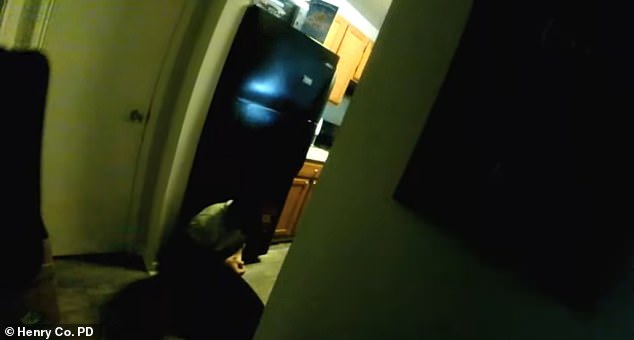
You are a GUI agent. You are given a task and a screenshot of the screen. Output one action in this format:
    pyautogui.click(x=<x>, y=<y>)
    Task: Click on the door knob
    
    Given the screenshot: What is the action you would take?
    pyautogui.click(x=141, y=117)